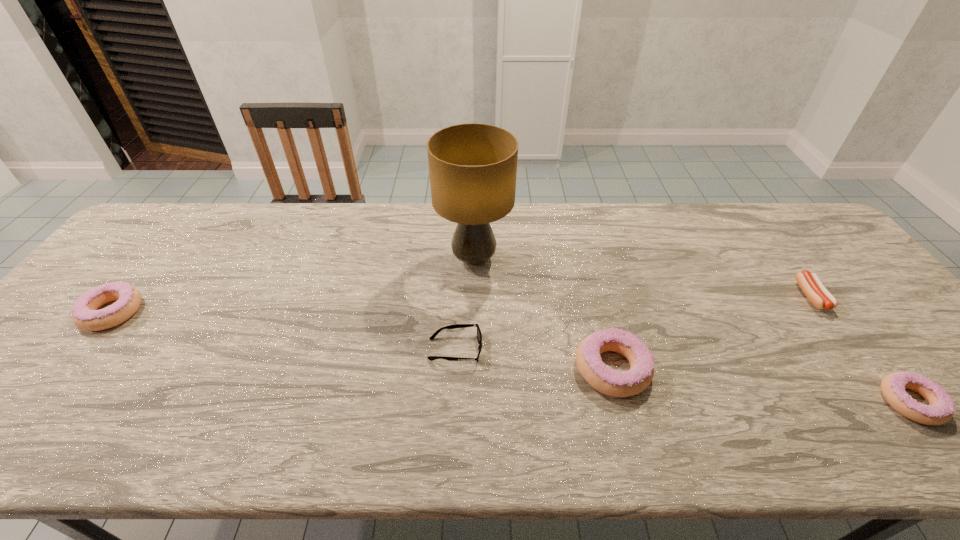
The width and height of the screenshot is (960, 540). I want to click on vacant area between the tallest object and the shortest object, so click(465, 304).

Locate an element on the screen. The width and height of the screenshot is (960, 540). vacant region between the fourth shortest object and the shortest object is located at coordinates pos(283,330).

Find the location of a particular element. vacant area that lies between the lampshade and the third object from right to left is located at coordinates (543, 314).

You are a GUI agent. You are given a task and a screenshot of the screen. Output one action in this format:
    pyautogui.click(x=<x>, y=<y>)
    Task: Click on the free space between the shortest object and the leftmost doughnut
    The image size is (960, 540).
    Given the screenshot: What is the action you would take?
    pyautogui.click(x=283, y=330)

Where is `free space between the second doughnut from left to right and the lampshade`? This screenshot has width=960, height=540. free space between the second doughnut from left to right and the lampshade is located at coordinates (543, 314).

Where is `free point between the shortest object and the tallest object`? The height and width of the screenshot is (540, 960). free point between the shortest object and the tallest object is located at coordinates (465, 304).

The height and width of the screenshot is (540, 960). Identify the location of free space between the lampshade and the third object from right to left. (543, 314).

This screenshot has width=960, height=540. Find the location of `the closest object to the second shortest object`. the closest object to the second shortest object is located at coordinates point(941,408).

Where is `object identified as the fourth closest to the farthest doughnut`? Image resolution: width=960 pixels, height=540 pixels. object identified as the fourth closest to the farthest doughnut is located at coordinates (811, 285).

The image size is (960, 540). In order to click on doughnut that stands as the closest to the third object from right to left in this screenshot , I will do `click(941, 408)`.